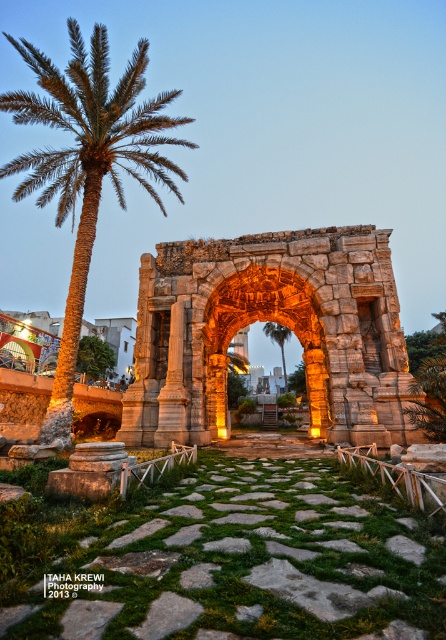
You are a tour guide explaining the historical site to visitors. You mention the carved stone arch at center and the green leafy palm at left. Which object is smaller in size?

The carved stone arch at center is smaller in size compared to the green leafy palm at left.

From the picture: You are standing at point [276,321] in the scene. What object is located at your current position?

The carved stone arch at center is located at point [276,321].

You are standing on the pathway in front of the historical stone archway. If you want to approach the carved stone arch at center, which direction should you move towards?

You should move towards the center of the scene, as the carved stone arch at center is located at point (276,321) in the image coordinates.